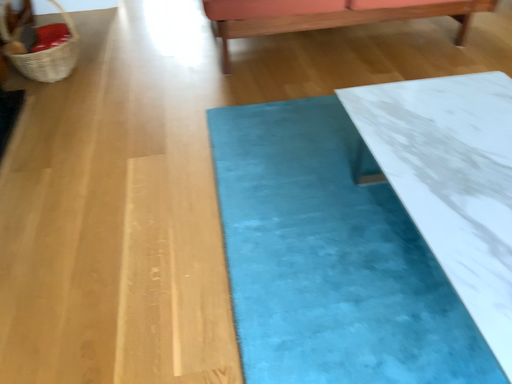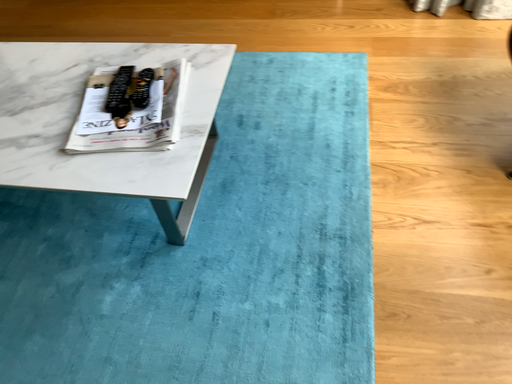
Question: How did the camera likely rotate when shooting the video?

Choices:
 (A) rotated downward
 (B) rotated upward

Answer: (B)